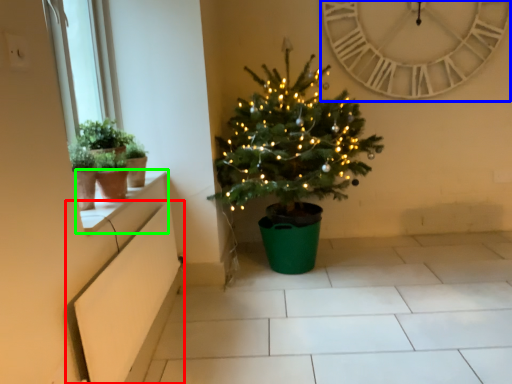
Question: Which object is positioned farthest from window box (highlighted by a red box)? Select from clock (highlighted by a blue box) and window sill (highlighted by a green box).

Choices:
 (A) clock
 (B) window sill

Answer: (A)